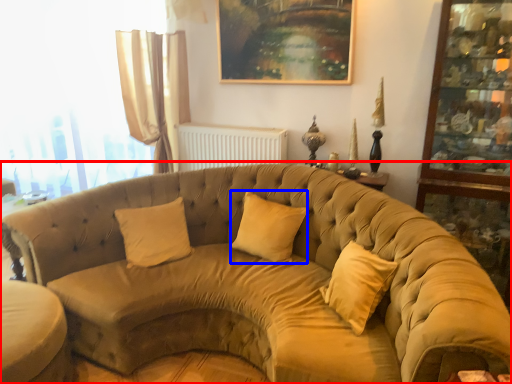
Question: Which point is closer to the camera, studio couch (highlighted by a red box) or pillow (highlighted by a blue box)?

Choices:
 (A) studio couch
 (B) pillow

Answer: (A)